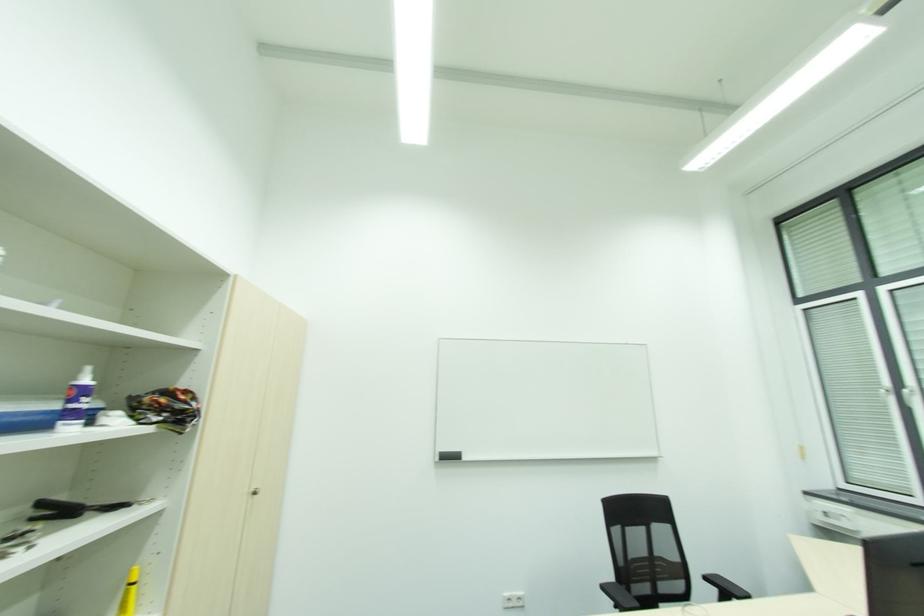
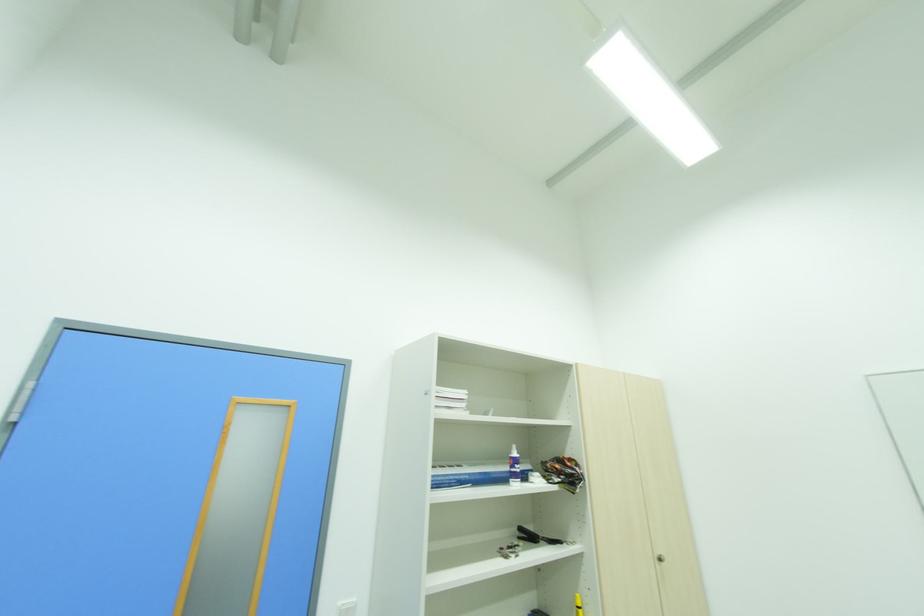
Question: How did the camera likely rotate?

Choices:
 (A) Left
 (B) Right
 (C) Up
 (D) Down

Answer: (A)